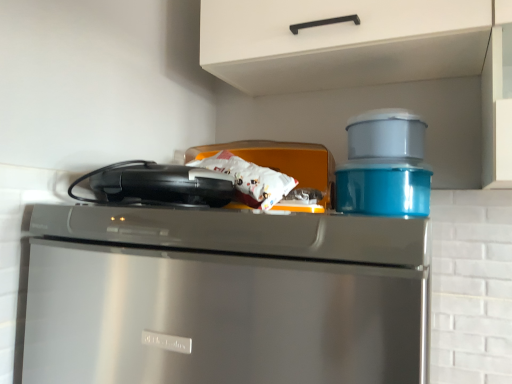
Question: In the image, is stainless steel dishwasher at upper center positioned in front of or behind black plastic toaster at upper left?

Choices:
 (A) front
 (B) behind

Answer: (A)

Question: Choose the correct answer: Is stainless steel dishwasher at upper center inside black plastic toaster at upper left or outside it?

Choices:
 (A) inside
 (B) outside

Answer: (B)

Question: Which is nearer to the orange plastic container at center, the first appliance when ordered from left to right?

Choices:
 (A) white matte cabinet handle at upper center
 (B) glossy plastic container at upper right, the third appliance from the left
 (C) black plastic toaster at upper left
 (D) matte plastic container at upper right, placed as the second appliance when sorted from left to right
 (E) stainless steel dishwasher at upper center

Answer: (B)

Question: Which object is positioned farthest from the matte plastic container at upper right, the second appliance from the right?

Choices:
 (A) stainless steel dishwasher at upper center
 (B) orange plastic container at center, the first appliance when ordered from left to right
 (C) black plastic toaster at upper left
 (D) glossy plastic container at upper right, the first appliance when ordered from right to left
 (E) white matte cabinet handle at upper center

Answer: (A)